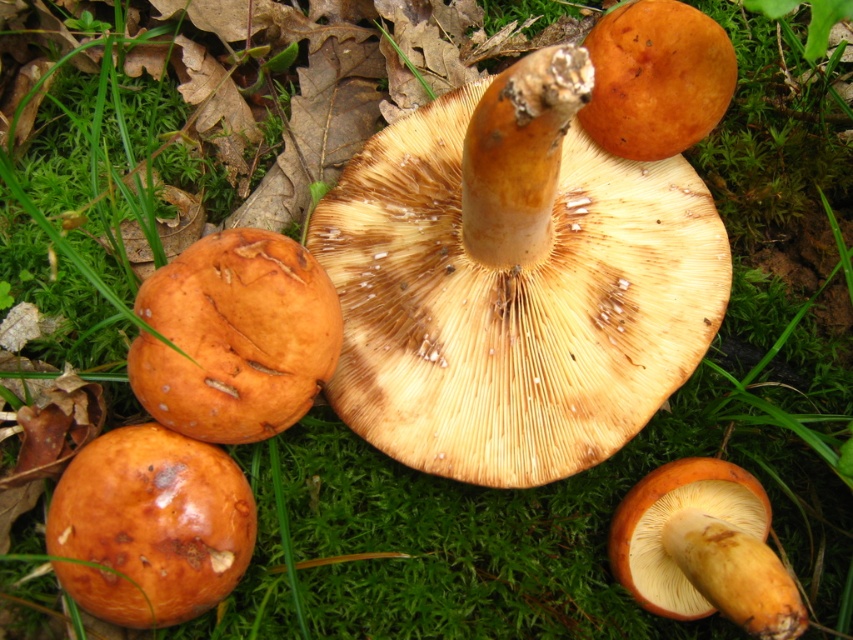
Question: Which point appears closest to the camera in this image?

Choices:
 (A) click(323, 368)
 (B) click(445, 460)

Answer: (A)

Question: Which object is the closest to the glossy orange mushroom at center?

Choices:
 (A) matte brown mushroom at center
 (B) shiny orange cap at center
 (C) matte orange mushroom at center

Answer: (C)

Question: Which of these objects is positioned farthest from the glossy orange mushroom at center?

Choices:
 (A) shiny brown mushroom at center
 (B) shiny orange cap at center

Answer: (B)

Question: Where is shiny brown mushroom at center located in relation to shiny orange cap at center in the image?

Choices:
 (A) above
 (B) below

Answer: (B)

Question: In this image, where is matte brown mushroom at center located relative to shiny orange cap at center?

Choices:
 (A) right
 (B) left

Answer: (B)

Question: Can you confirm if matte brown mushroom at center is positioned to the left of glossy orange mushroom at center?

Choices:
 (A) no
 (B) yes

Answer: (A)